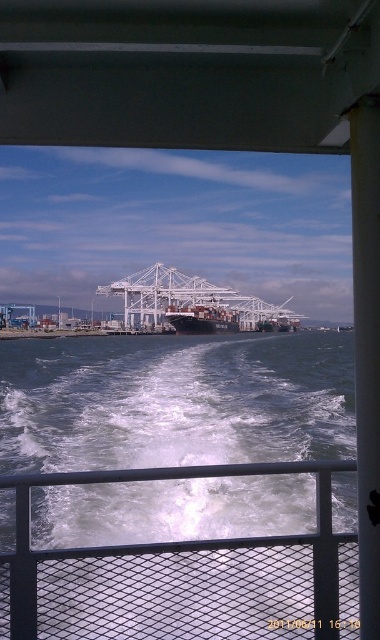
Between black metal/rail at center and black matte container ship at center, which one appears on the left side from the viewer's perspective?

black metal/rail at center

Can you confirm if black metal/rail at center is wider than black matte container ship at center?

No.

Locate an element on the screen. black metal/rail at center is located at coordinates (185, 573).